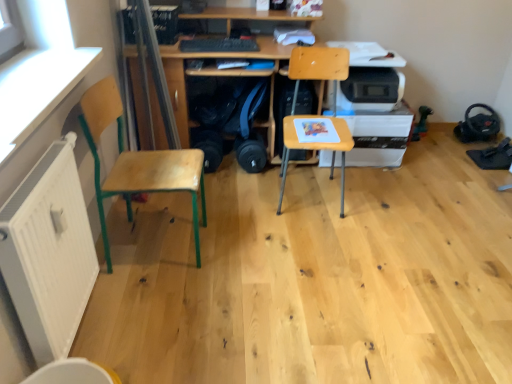
Question: Considering the positions of point (326, 72) and point (131, 67), is point (326, 72) closer or farther from the camera than point (131, 67)?

Choices:
 (A) closer
 (B) farther

Answer: (A)

Question: Looking at their shapes, would you say wooden chair at center, arranged as the first chair when viewed from the right, is wider or thinner than wooden desk at center?

Choices:
 (A) thin
 (B) wide

Answer: (A)

Question: Which is farther from the wooden chair at center, arranged as the first chair when viewed from the right?

Choices:
 (A) transparent plastic window screen at left
 (B) black matte keyboard at center
 (C) white matte radiator at lower left
 (D) wooden at left, positioned as the 2th chair in right-to-left order
 (E) white plastic printer at center right

Answer: (C)

Question: Estimate the real-world distances between objects in this image. Which object is farther from the white matte radiator at lower left?

Choices:
 (A) white plastic printer at center right
 (B) black matte keyboard at center
 (C) wooden at left, positioned as the 2th chair in right-to-left order
 (D) wooden desk at center
 (E) wooden chair at center, the second chair when ordered from left to right

Answer: (A)